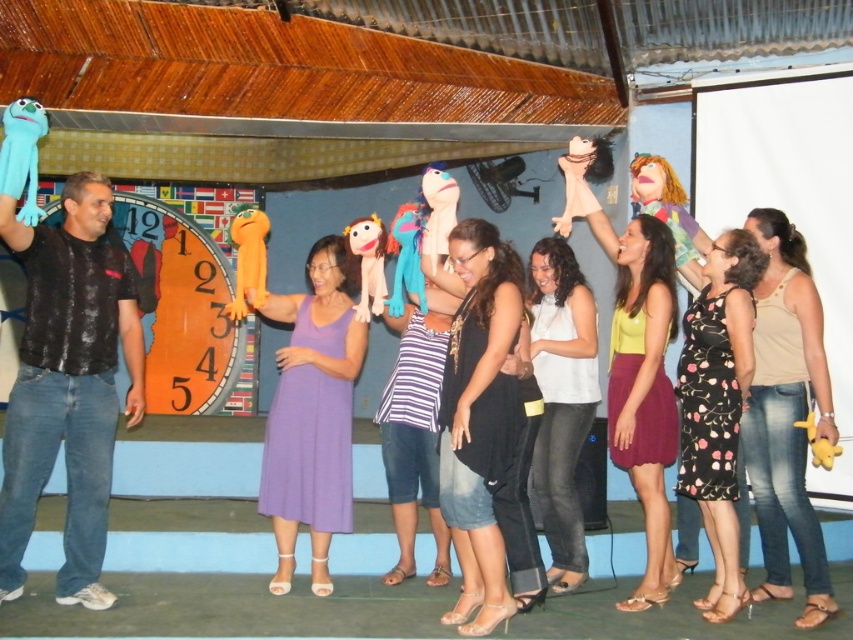
Does point (73, 193) come in front of point (32, 180)?

No, it is behind (32, 180).

Describe the element at coordinates (68, 384) in the screenshot. I see `black matte shirt at left` at that location.

I want to click on black matte shirt at left, so click(x=68, y=384).

Measure the distance from matte yellow blouse at center to matte pink doll at upper right.

The distance of matte yellow blouse at center from matte pink doll at upper right is 1.07 meters.

Between matte yellow blouse at center and matte pink doll at upper right, which one has less height?

matte pink doll at upper right is shorter.

Where is `matte yellow blouse at center`? The image size is (853, 640). matte yellow blouse at center is located at coordinates (637, 369).

Can you confirm if orange plush at center is wider than soft plush puppet at center?

Yes, orange plush at center is wider than soft plush puppet at center.

Does orange plush at center appear over soft plush puppet at center?

Yes, orange plush at center is above soft plush puppet at center.

Does point (231, 307) come behind point (368, 216)?

No, (231, 307) is closer to viewer.

Image resolution: width=853 pixels, height=640 pixels. Identify the location of orange plush at center. (248, 260).